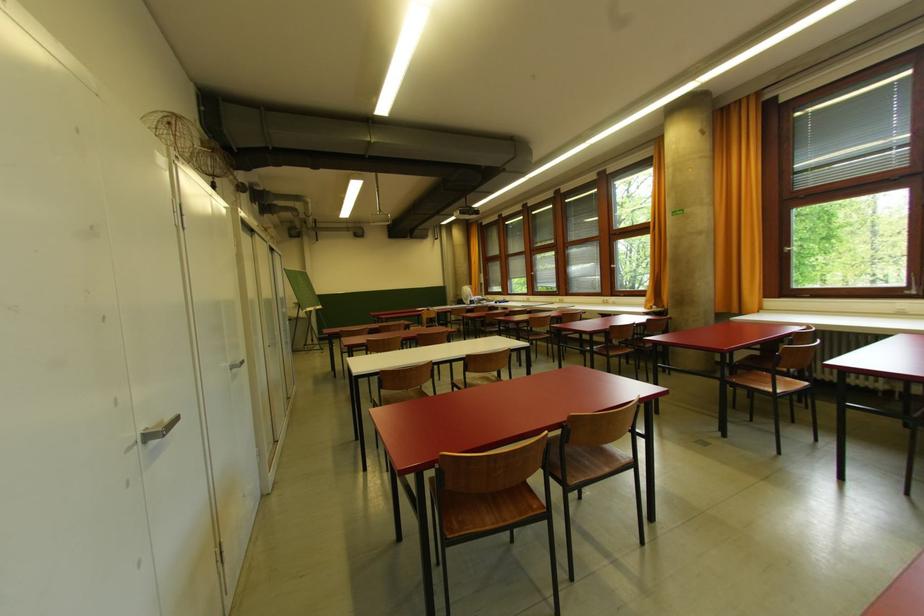
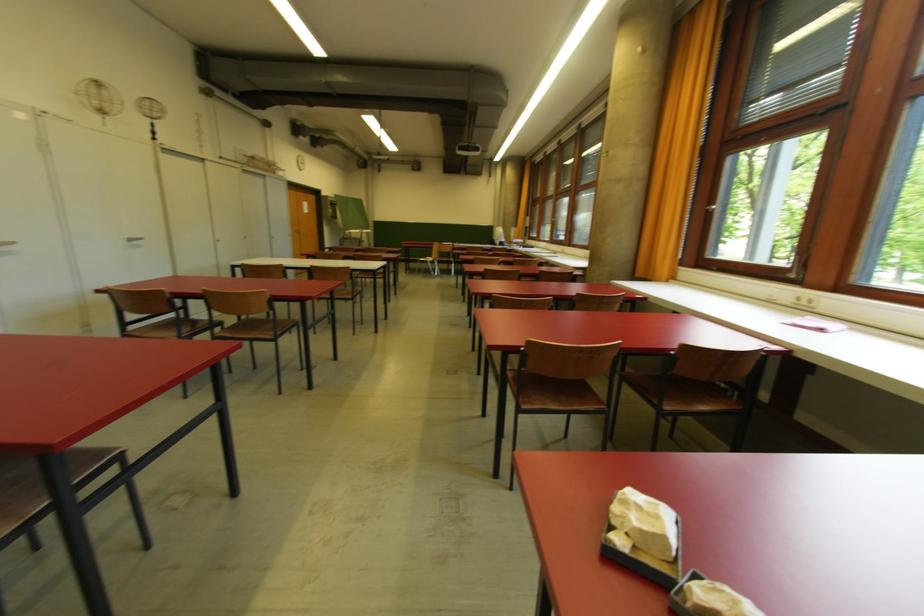
Find the pixel in the second image that matches (x=788, y=253) in the first image.

(713, 213)